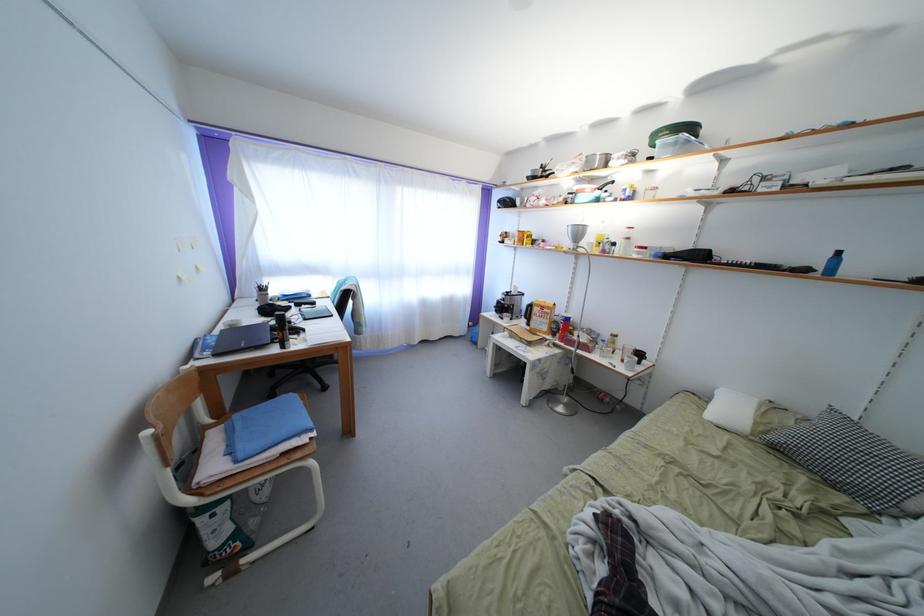
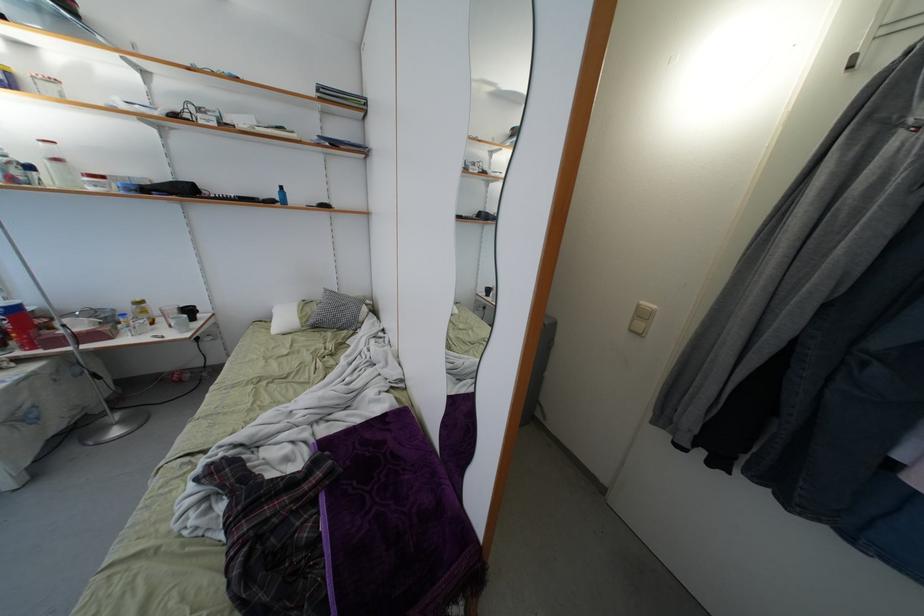
Where in the second image is the point corresponding to [650,254] from the first image?

(110, 184)